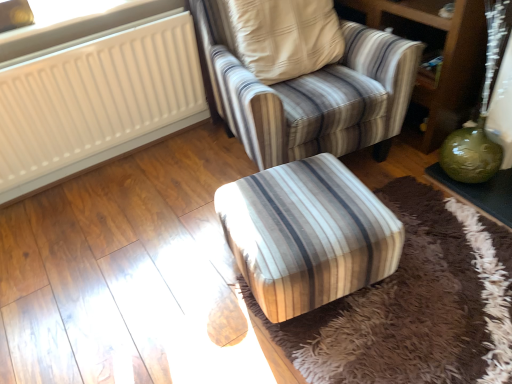
This screenshot has height=384, width=512. In order to click on free spot in front of green glossy vase at right in this screenshot , I will do `click(477, 249)`.